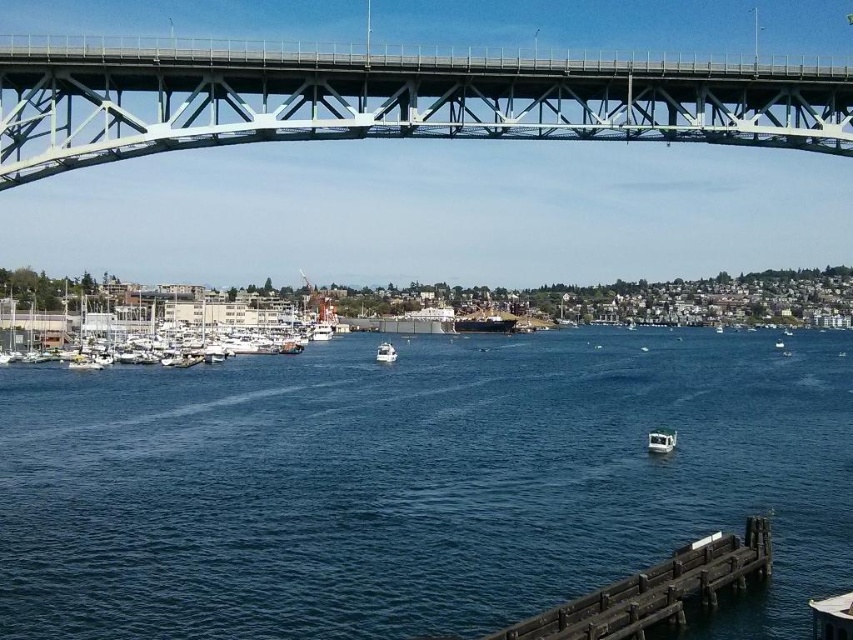
Looking at this image, you are a tour guide explaining the waterfront area to visitors. You mention the gray metallic bridge at upper center and the white glossy boat at center. How far apart are these two landmarks?

The gray metallic bridge at upper center and the white glossy boat at center are 80.95 meters apart.

You are standing on the dock and want to take a photo of the gray metallic bridge at upper center and the white glossy boat at lower center. Which object should you place on the left side of your photo frame to capture both in the scene as shown?

You should place the gray metallic bridge at upper center on the left side of your photo frame since it is already positioned on the left side of the white glossy boat at lower center in the scene.

You are a photographer planning to capture the gray metallic bridge at upper center and the white glossy boat at center in a single frame. Given that the camera can only accommodate objects within a 10m width, can both objects fit side by side without overlapping?

The gray metallic bridge at upper center is wider than the white glossy boat at center. Since the camera can only accommodate objects within a 10m width, it depends on the combined width of both objects. However, the description only provides a comparison of their widths, not their exact measurements. Therefore, it is uncertain if they can fit without overlapping.